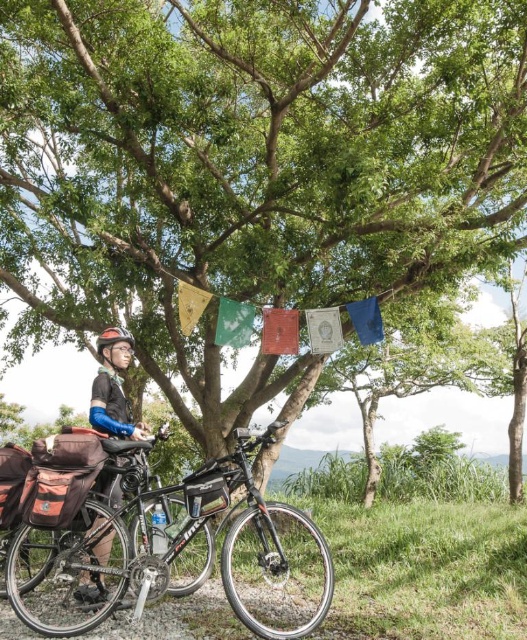
You are a delivery person who needs to load a package onto your shiny metallic bicycle at center. The package is as wide as your matte black helmet at upper left. Can the package fit horizontally on the bicycle?

The shiny metallic bicycle at center is wider than the matte black helmet at upper left, so the package should fit horizontally as the bicycle is wider than the helmet.

You are a cyclist who wants to attach a small GPS tracker to their bicycle. The GPS tracker must be placed on the shiny metallic bicycle at center. The GPS tracker has a diameter of 5 cm. The point at coordinates point (159, 540) is the center of the GPS tracker. Is there enough space on the shiny metallic bicycle at center to place the GPS tracker without overlapping any other objects?

The point at coordinates point (159, 540) is on shiny metallic bicycle at center, so yes, there is enough space to place the GPS tracker there as long as that area is free from obstructions. However, the description does not mention any overlapping objects at that specific point.

From the picture: You are the cyclist in the scene. You notice two points marked on the ground near your bicycle. The first point is at coordinates point (50,506) and the second is at point (104,394). Which point is closer to you as you stand facing the direction you were cycling?

Point (50,506) is in front of point (104,394), so it is closer to you as you stand facing the direction you were cycling.